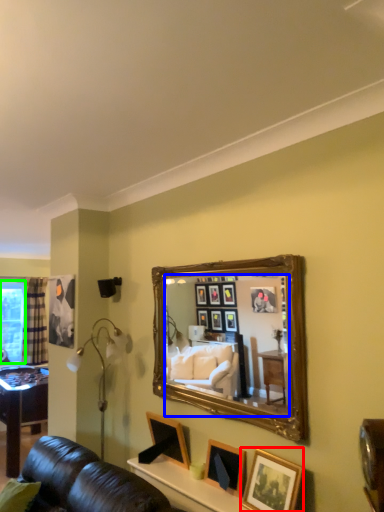
Question: Which object is positioned closest to picture frame (highlighted by a red box)? Select from mirror (highlighted by a blue box) and window screen (highlighted by a green box).

Choices:
 (A) mirror
 (B) window screen

Answer: (A)